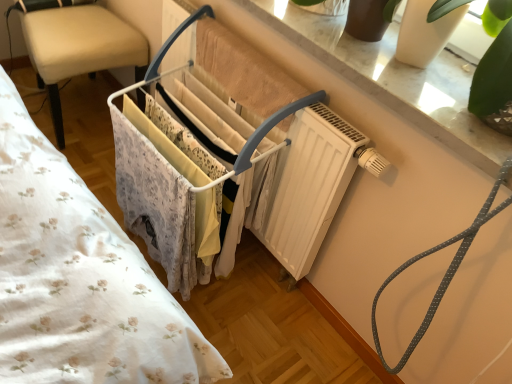
Question: From a real-world perspective, is white marble window sill at upper center physically below gray dotted rope at upper right?

Choices:
 (A) no
 (B) yes

Answer: (A)

Question: Could you tell me if white marble window sill at upper center is facing gray dotted rope at upper right?

Choices:
 (A) yes
 (B) no

Answer: (B)

Question: Is white marble window sill at upper center next to gray dotted rope at upper right?

Choices:
 (A) no
 (B) yes

Answer: (A)

Question: Can you confirm if white marble window sill at upper center is shorter than gray dotted rope at upper right?

Choices:
 (A) no
 (B) yes

Answer: (B)

Question: Is gray dotted rope at upper right located within white marble window sill at upper center?

Choices:
 (A) no
 (B) yes

Answer: (A)

Question: Is white marble window sill at upper center closer to the viewer compared to gray dotted rope at upper right?

Choices:
 (A) no
 (B) yes

Answer: (A)

Question: From a real-world perspective, is beige leather chair at left located beneath white plastic clothes rack at center?

Choices:
 (A) no
 (B) yes

Answer: (B)

Question: Is beige leather chair at left oriented towards white plastic clothes rack at center?

Choices:
 (A) no
 (B) yes

Answer: (B)

Question: Is beige leather chair at left to the left of white plastic clothes rack at center from the viewer's perspective?

Choices:
 (A) yes
 (B) no

Answer: (A)

Question: Considering the relative sizes of beige leather chair at left and white plastic clothes rack at center in the image provided, is beige leather chair at left shorter than white plastic clothes rack at center?

Choices:
 (A) yes
 (B) no

Answer: (A)

Question: Is beige leather chair at left not inside white plastic clothes rack at center?

Choices:
 (A) no
 (B) yes

Answer: (B)

Question: Considering the relative sizes of beige leather chair at left and white plastic clothes rack at center in the image provided, is beige leather chair at left smaller than white plastic clothes rack at center?

Choices:
 (A) no
 (B) yes

Answer: (B)

Question: Is white plastic clothes rack at center oriented towards gray dotted rope at upper right?

Choices:
 (A) yes
 (B) no

Answer: (B)